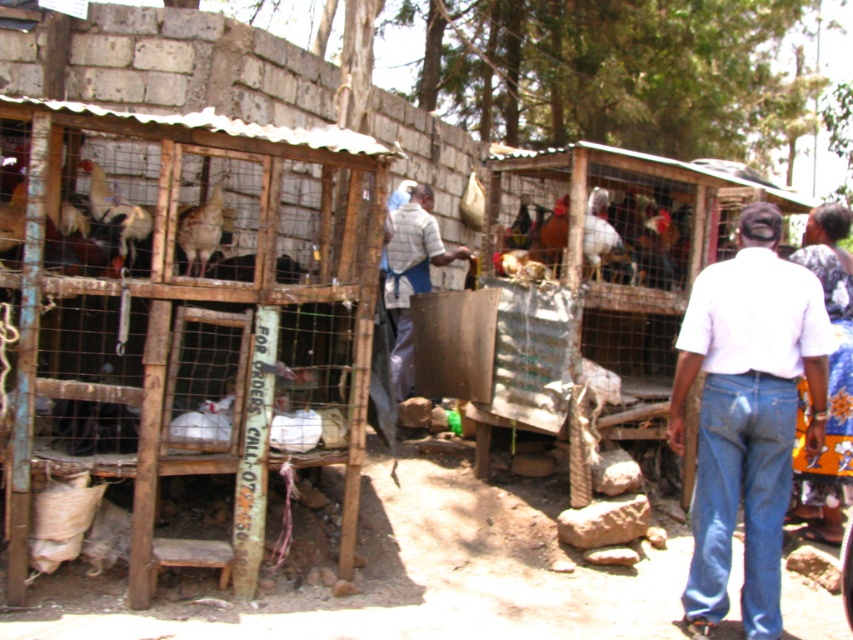
Question: Is white cotton shirt at center positioned before striped fabric shirt at center?

Choices:
 (A) no
 (B) yes

Answer: (B)

Question: Is white cotton shirt at center closer to camera compared to striped fabric shirt at center?

Choices:
 (A) no
 (B) yes

Answer: (B)

Question: Which object is farther from the camera taking this photo?

Choices:
 (A) white cotton shirt at center
 (B) striped fabric shirt at center

Answer: (B)

Question: Is white cotton shirt at center bigger than striped fabric shirt at center?

Choices:
 (A) no
 (B) yes

Answer: (A)

Question: Among these points, which one is farthest from the camera?

Choices:
 (A) (422, 257)
 (B) (779, 548)

Answer: (A)

Question: Which of the following is the closest to the observer?

Choices:
 (A) (770, 225)
 (B) (401, 307)

Answer: (A)